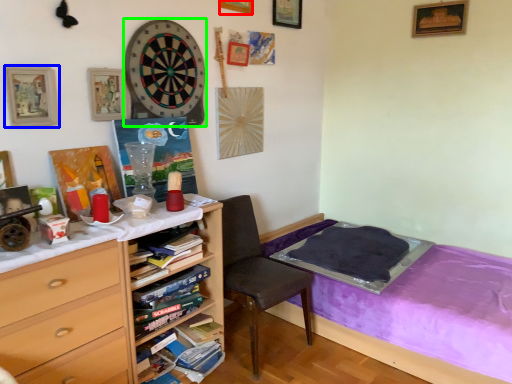
Question: Which is farther away from picture frame (highlighted by a red box)? picture frame (highlighted by a blue box) or clock (highlighted by a green box)?

Choices:
 (A) picture frame
 (B) clock

Answer: (A)